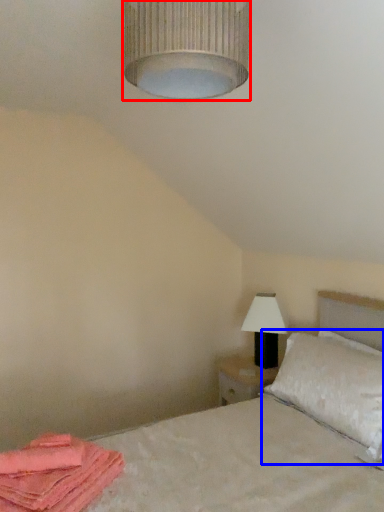
Question: Which point is further to the camera, lamp (highlighted by a red box) or pillow (highlighted by a blue box)?

Choices:
 (A) lamp
 (B) pillow

Answer: (B)